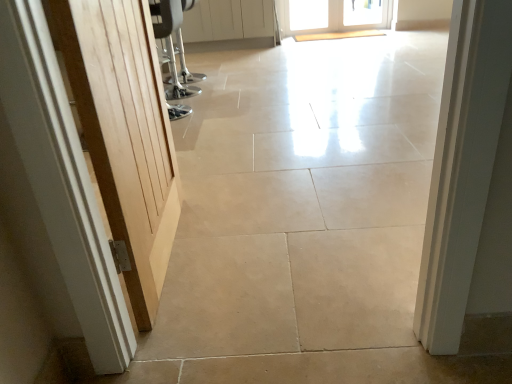
Question: From a real-world perspective, is white glass door at upper center, which appears as the first door when viewed from the back, under white glossy door at upper center, the second door ordered from the bottom?

Choices:
 (A) no
 (B) yes

Answer: (B)

Question: Is white glass door at upper center, which is the 1th door in right-to-left order, positioned in front of white glossy door at upper center, which is the first door in left-to-right order?

Choices:
 (A) yes
 (B) no

Answer: (B)

Question: From the image's perspective, is white glass door at upper center, which is the third door from bottom to top, above white glossy door at upper center, which is the first door in left-to-right order?

Choices:
 (A) no
 (B) yes

Answer: (B)

Question: From a real-world perspective, does white glass door at upper center, which is the 3th door from left to right, stand above white glossy door at upper center, placed as the 2th door when sorted from front to back?

Choices:
 (A) yes
 (B) no

Answer: (B)

Question: Considering the relative positions of white glass door at upper center, which appears as the first door when viewed from the back, and white glossy door at upper center, the 2th door from the top, in the image provided, is white glass door at upper center, which appears as the first door when viewed from the back, behind white glossy door at upper center, the 2th door from the top,?

Choices:
 (A) no
 (B) yes

Answer: (B)

Question: In terms of width, does white glossy door at upper center, which is the first door in left-to-right order, look wider or thinner when compared to white glass door at upper center, which is the third door from bottom to top?

Choices:
 (A) thin
 (B) wide

Answer: (B)

Question: From a real-world perspective, relative to white glass door at upper center, the third door viewed from the front, is white glossy door at upper center, the second door ordered from the bottom, vertically above or below?

Choices:
 (A) above
 (B) below

Answer: (A)

Question: Is point (268, 28) closer or farther from the camera than point (290, 14)?

Choices:
 (A) farther
 (B) closer

Answer: (A)

Question: Which is correct: white glossy door at upper center, the third door in the right-to-left sequence, is inside white glass door at upper center, marked as the 1th door in a top-to-bottom arrangement, or outside of it?

Choices:
 (A) outside
 (B) inside

Answer: (A)

Question: Is point (340, 26) closer or farther from the camera than point (268, 3)?

Choices:
 (A) closer
 (B) farther

Answer: (B)

Question: Considering the relative positions of white glass door at upper center, which appears as the first door when viewed from the back, and white glossy door at upper center, the second door ordered from the bottom, in the image provided, is white glass door at upper center, which appears as the first door when viewed from the back, to the left or to the right of white glossy door at upper center, the second door ordered from the bottom,?

Choices:
 (A) left
 (B) right

Answer: (B)

Question: Considering their positions, is white glass door at upper center, which is the third door from bottom to top, located in front of or behind white glossy door at upper center, which is counted as the second door, starting from the back?

Choices:
 (A) behind
 (B) front

Answer: (A)

Question: Is white glass door at upper center, which appears as the first door when viewed from the back, situated inside white glossy door at upper center, which is the first door in left-to-right order, or outside?

Choices:
 (A) inside
 (B) outside

Answer: (B)

Question: Is white glossy door at upper center, the third door in the right-to-left sequence, spatially inside light wood door at left, acting as the 2th door starting from the left, or outside of it?

Choices:
 (A) inside
 (B) outside

Answer: (B)

Question: From their relative heights in the image, would you say white glossy door at upper center, which is the first door in left-to-right order, is taller or shorter than light wood door at left, which is the 1th door from bottom to top?

Choices:
 (A) short
 (B) tall

Answer: (A)